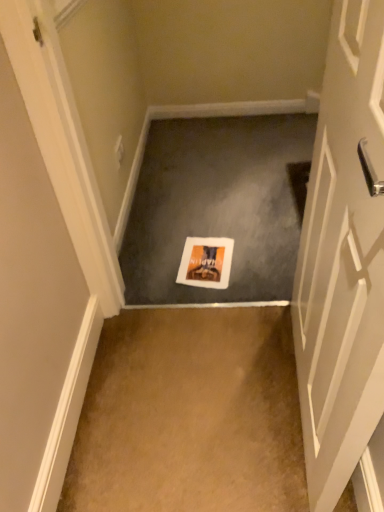
What is the approximate width of brown carpet at center, marked as the first concrete in a bottom-to-top arrangement?

The width of brown carpet at center, marked as the first concrete in a bottom-to-top arrangement, is 27.12 inches.

The width and height of the screenshot is (384, 512). Find the location of `orange matte postcard at center`. orange matte postcard at center is located at coordinates 206,262.

In order to click on white paper at center, the 2th concrete in the front-to-back sequence in this screenshot , I will do `click(219, 205)`.

Describe the element at coordinates (344, 269) in the screenshot. This screenshot has width=384, height=512. I see `white glossy door at center right` at that location.

Image resolution: width=384 pixels, height=512 pixels. I want to click on brown carpet at center, marked as the first concrete in a bottom-to-top arrangement, so pos(190,415).

Relative to white paper at center, which appears as the 1th concrete when viewed from the back, is orange matte postcard at center in front or behind?

orange matte postcard at center is behind white paper at center, which appears as the 1th concrete when viewed from the back.

Could you tell me if orange matte postcard at center is facing white paper at center, which appears as the 1th concrete when viewed from the back?

No, orange matte postcard at center is not oriented towards white paper at center, which appears as the 1th concrete when viewed from the back.

Are orange matte postcard at center and white paper at center, the 2th concrete in the front-to-back sequence, making contact?

No.

Is orange matte postcard at center outside of white paper at center, the 2th concrete positioned from the bottom?

Yes, orange matte postcard at center is outside of white paper at center, the 2th concrete positioned from the bottom.

Considering the relative positions of white glossy door at center right and brown carpet at center, which is counted as the 2th concrete, starting from the top, in the image provided, is white glossy door at center right behind brown carpet at center, which is counted as the 2th concrete, starting from the top,?

No, it is in front of brown carpet at center, which is counted as the 2th concrete, starting from the top.

How much distance is there between white glossy door at center right and brown carpet at center, positioned as the 2th concrete in back-to-front order?

The distance of white glossy door at center right from brown carpet at center, positioned as the 2th concrete in back-to-front order, is 44.13 centimeters.

Is white glossy door at center right not inside brown carpet at center, which is counted as the first concrete, starting from the front?

white glossy door at center right lies outside brown carpet at center, which is counted as the first concrete, starting from the front,'s area.

Considering the relative sizes of white glossy door at center right and brown carpet at center, which is counted as the first concrete, starting from the front, in the image provided, is white glossy door at center right shorter than brown carpet at center, which is counted as the first concrete, starting from the front,?

In fact, white glossy door at center right may be taller than brown carpet at center, which is counted as the first concrete, starting from the front.

What's the angular difference between orange matte postcard at center and white glossy door at center right's facing directions?

The angle between the facing direction of orange matte postcard at center and the facing direction of white glossy door at center right is 87.6 degrees.

Is orange matte postcard at center at the left side of white glossy door at center right?

Yes, orange matte postcard at center is to the left of white glossy door at center right.

Relative to white glossy door at center right, is orange matte postcard at center in front or behind?

orange matte postcard at center is behind white glossy door at center right.

From their relative heights in the image, would you say brown carpet at center, which is counted as the first concrete, starting from the front, is taller or shorter than orange matte postcard at center?

Considering their sizes, brown carpet at center, which is counted as the first concrete, starting from the front, has more height than orange matte postcard at center.

Which object is wider, brown carpet at center, positioned as the 2th concrete in back-to-front order, or orange matte postcard at center?

brown carpet at center, positioned as the 2th concrete in back-to-front order.

Considering the positions of objects brown carpet at center, marked as the first concrete in a bottom-to-top arrangement, and orange matte postcard at center in the image provided, who is more to the left, brown carpet at center, marked as the first concrete in a bottom-to-top arrangement, or orange matte postcard at center?

From the viewer's perspective, brown carpet at center, marked as the first concrete in a bottom-to-top arrangement, appears more on the left side.

Is white glossy door at center right surrounding orange matte postcard at center?

No, orange matte postcard at center is not inside white glossy door at center right.

From the picture: Between white glossy door at center right and orange matte postcard at center, which one has smaller width?

white glossy door at center right.

Does white glossy door at center right turn towards orange matte postcard at center?

No.

In the scene shown: From a real-world perspective, which object rests below the other?

orange matte postcard at center.

Is white paper at center, which appears as the 1th concrete when viewed from the back, wider than brown carpet at center, which is counted as the 2th concrete, starting from the top?

Correct, the width of white paper at center, which appears as the 1th concrete when viewed from the back, exceeds that of brown carpet at center, which is counted as the 2th concrete, starting from the top.

Which object is positioned more to the left, white paper at center, which appears as the 1th concrete when viewed from the back, or brown carpet at center, which is counted as the first concrete, starting from the front?

From the viewer's perspective, brown carpet at center, which is counted as the first concrete, starting from the front, appears more on the left side.

Is white paper at center, which ranks as the 1th concrete in top-to-bottom order, far from brown carpet at center, positioned as the 2th concrete in back-to-front order?

That's not correct — white paper at center, which ranks as the 1th concrete in top-to-bottom order, is a little close to brown carpet at center, positioned as the 2th concrete in back-to-front order.

How many degrees apart are the facing directions of white paper at center, the 2th concrete positioned from the bottom, and brown carpet at center, which is counted as the 2th concrete, starting from the top?

The angular difference between white paper at center, the 2th concrete positioned from the bottom, and brown carpet at center, which is counted as the 2th concrete, starting from the top, is 5.39e-05 degrees.

Looking at this image, from a real-world perspective, is white paper at center, the 2th concrete in the front-to-back sequence, below orange matte postcard at center?

Yes, from a real-world perspective, white paper at center, the 2th concrete in the front-to-back sequence, is beneath orange matte postcard at center.

Could you tell me if white paper at center, which appears as the 1th concrete when viewed from the back, is turned towards orange matte postcard at center?

No, white paper at center, which appears as the 1th concrete when viewed from the back, does not turn towards orange matte postcard at center.

At what (x,y) coordinates should I click in order to perform the action: click on the 1st concrete in front of the orange matte postcard at center. Please return your answer as a coordinate pair (x, y). Looking at the image, I should click on (219, 205).

Is white paper at center, the 2th concrete positioned from the bottom, located outside orange matte postcard at center?

Yes, white paper at center, the 2th concrete positioned from the bottom, is outside of orange matte postcard at center.

From a real-world perspective, which concrete is the 1st one underneath the orange matte postcard at center? Please provide its 2D coordinates.

[(219, 205)]

Find the location of a particular element. This screenshot has height=512, width=384. door in front of the brown carpet at center, which is counted as the 2th concrete, starting from the top is located at coordinates (344, 269).

Consider the image. Estimate the real-world distances between objects in this image. Which object is further from white paper at center, which appears as the 1th concrete when viewed from the back, brown carpet at center, positioned as the 2th concrete in back-to-front order, or white glossy door at center right?

white glossy door at center right lies further to white paper at center, which appears as the 1th concrete when viewed from the back, than the other object.

Which object lies further to the anchor point white glossy door at center right, white paper at center, which appears as the 1th concrete when viewed from the back, or brown carpet at center, which is counted as the first concrete, starting from the front?

Based on the image, white paper at center, which appears as the 1th concrete when viewed from the back, appears to be further to white glossy door at center right.

When comparing their distances from orange matte postcard at center, does white glossy door at center right or brown carpet at center, marked as the first concrete in a bottom-to-top arrangement, seem further?

white glossy door at center right lies further to orange matte postcard at center than the other object.

When comparing their distances from brown carpet at center, which is counted as the 2th concrete, starting from the top, does orange matte postcard at center or white paper at center, the 2th concrete positioned from the bottom, seem further?

white paper at center, the 2th concrete positioned from the bottom.

Considering their positions, is orange matte postcard at center positioned further to white paper at center, which ranks as the 1th concrete in top-to-bottom order, than white glossy door at center right?

Among the two, white glossy door at center right is located further to white paper at center, which ranks as the 1th concrete in top-to-bottom order.

Based on their spatial positions, is white paper at center, which ranks as the 1th concrete in top-to-bottom order, or white glossy door at center right closer to orange matte postcard at center?

Based on the image, white paper at center, which ranks as the 1th concrete in top-to-bottom order, appears to be nearer to orange matte postcard at center.

Estimate the real-world distances between objects in this image. Which object is closer to white paper at center, which ranks as the 1th concrete in top-to-bottom order, orange matte postcard at center or brown carpet at center, positioned as the 2th concrete in back-to-front order?

orange matte postcard at center.

Based on their spatial positions, is white glossy door at center right or orange matte postcard at center closer to white paper at center, which ranks as the 1th concrete in top-to-bottom order?

orange matte postcard at center lies closer to white paper at center, which ranks as the 1th concrete in top-to-bottom order, than the other object.

Find the location of a particular element. The height and width of the screenshot is (512, 384). postcard that lies between white paper at center, which ranks as the 1th concrete in top-to-bottom order, and brown carpet at center, which is counted as the 2th concrete, starting from the top, from top to bottom is located at coordinates (206, 262).

Locate an element on the screen. Image resolution: width=384 pixels, height=512 pixels. concrete between white glossy door at center right and white paper at center, which ranks as the 1th concrete in top-to-bottom order, from front to back is located at coordinates (190, 415).